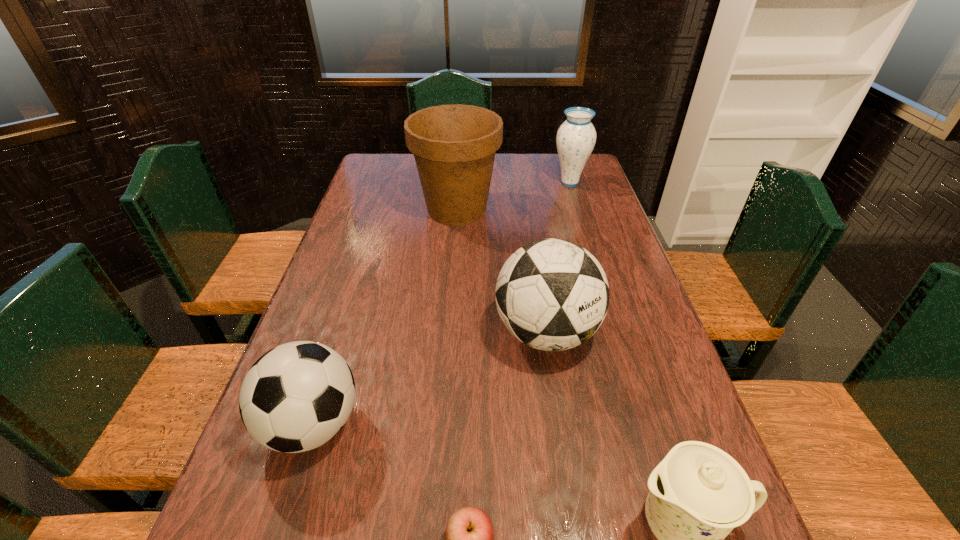
Image resolution: width=960 pixels, height=540 pixels. In order to click on flowerpot in this screenshot , I will do `click(454, 146)`.

Where is `vase`? The width and height of the screenshot is (960, 540). vase is located at coordinates click(576, 137).

You are a GUI agent. You are given a task and a screenshot of the screen. Output one action in this format:
    pyautogui.click(x=<x>, y=<y>)
    Task: Click on the third farthest object
    The width and height of the screenshot is (960, 540).
    Given the screenshot: What is the action you would take?
    pyautogui.click(x=552, y=294)

At what (x,y) coordinates should I click in order to perform the action: click on the taller soccer ball. Please return your answer as a coordinate pair (x, y). This screenshot has height=540, width=960. Looking at the image, I should click on (552, 294).

The image size is (960, 540). What are the coordinates of `the leftmost object` in the screenshot? It's located at (296, 397).

Where is `the shorter soccer ball`? This screenshot has height=540, width=960. the shorter soccer ball is located at coordinates (296, 397).

Locate an element on the screen. free spot located 0.120m on the right of the flowerpot is located at coordinates (535, 210).

Locate an element on the screen. This screenshot has width=960, height=540. vacant space located on the left of the vase is located at coordinates (481, 183).

In order to click on vacant space situated 0.240m on the surface of the taller soccer ball where the brand logo is visible in this screenshot , I will do `click(568, 478)`.

Locate an element on the screen. This screenshot has height=540, width=960. vacant space located on the right of the nearer soccer ball is located at coordinates (386, 424).